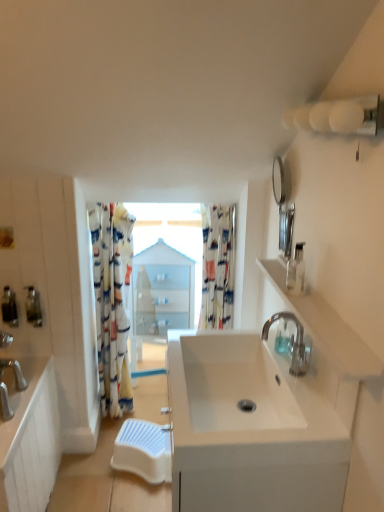
The width and height of the screenshot is (384, 512). What are the coordinates of `empty space that is ontop of printed fabric shower curtain at left, placed as the second shower curtain when sorted from right to left (from a real-world perspective)` in the screenshot? It's located at (120, 198).